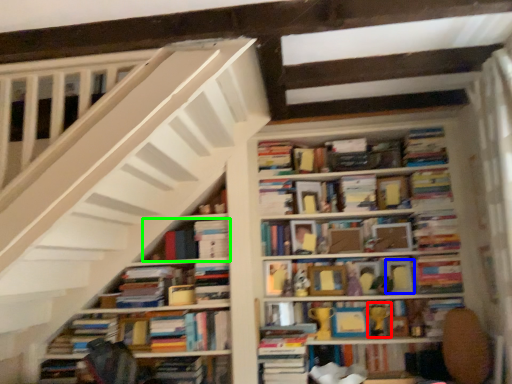
Question: Which is nearer to the toy (highlighted by a red box)? paperback book (highlighted by a blue box) or book (highlighted by a green box).

Choices:
 (A) paperback book
 (B) book

Answer: (A)